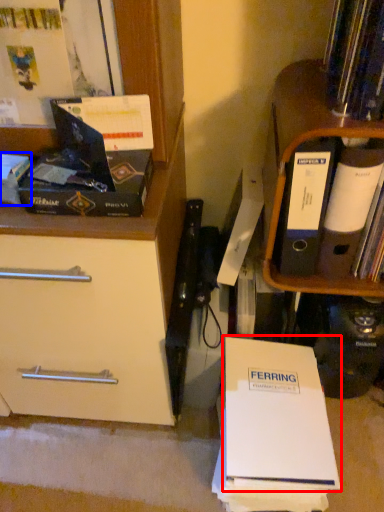
Question: Among these objects, which one is farthest to the camera, paperback book (highlighted by a red box) or book (highlighted by a blue box)?

Choices:
 (A) paperback book
 (B) book

Answer: (A)